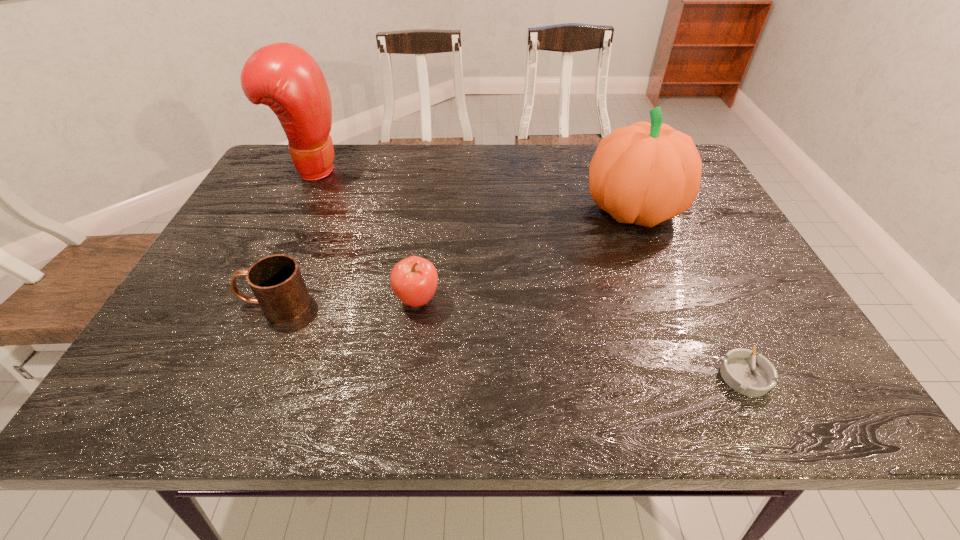
Locate an element on the screen. free space that satisfies the following two spatial constraints: 1. on the front side of the apple; 2. on the side of the fourth tallest object with the handle is located at coordinates (417, 303).

Find the location of `vacant space that satisfies the following two spatial constraints: 1. on the striking surface of the boxing glove; 2. on the back side of the pumpkin`. vacant space that satisfies the following two spatial constraints: 1. on the striking surface of the boxing glove; 2. on the back side of the pumpkin is located at coordinates (292, 210).

Identify the location of vacant space that satisfies the following two spatial constraints: 1. on the front side of the apple; 2. on the side of the fourth tallest object with the handle. The width and height of the screenshot is (960, 540). (417, 303).

Identify the location of free space in the image that satisfies the following two spatial constraints: 1. on the front side of the second tallest object; 2. on the side of the fourth tallest object with the handle. (671, 303).

The image size is (960, 540). In order to click on vacant region that satisfies the following two spatial constraints: 1. on the front side of the third tallest object; 2. on the side of the fourth tallest object with the handle in this screenshot , I will do `click(417, 303)`.

At what (x,y) coordinates should I click in order to perform the action: click on free space that satisfies the following two spatial constraints: 1. on the back side of the pumpkin; 2. on the right side of the third object from left to right. Please return your answer as a coordinate pair (x, y). This screenshot has width=960, height=540. Looking at the image, I should click on (429, 210).